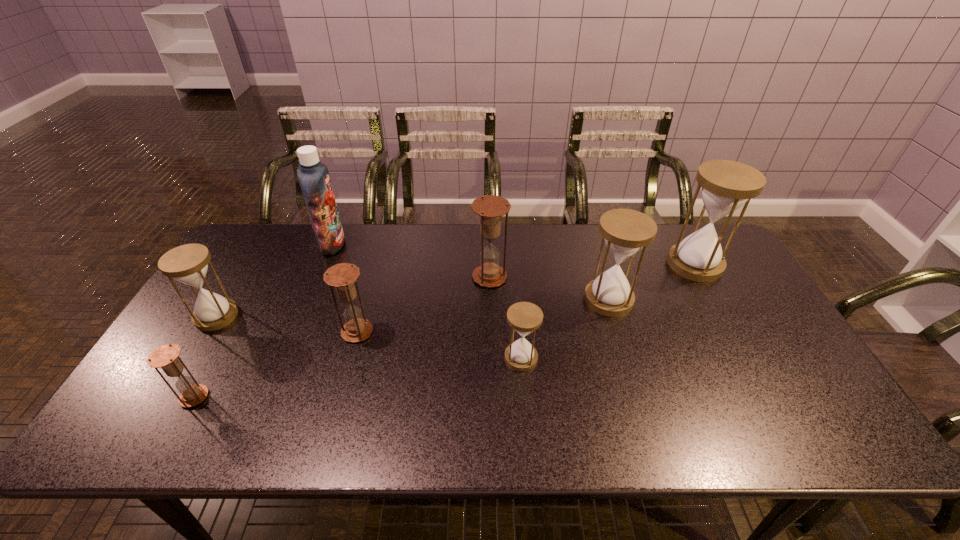
This screenshot has width=960, height=540. Identify the location of vacant space at the far left corner of the desktop. (242, 237).

Where is `vacant space at the near left corner`? The width and height of the screenshot is (960, 540). vacant space at the near left corner is located at coordinates (177, 421).

What are the coordinates of `vacant space at the near right corner of the desktop` in the screenshot? It's located at (804, 431).

Identify the location of vacant area that lies between the nearest white hourglass and the farthest brown hourglass. (505, 318).

Identify the location of vacant area that lies between the sixth hourglass from left to right and the nearest hourglass. Image resolution: width=960 pixels, height=540 pixels. (401, 348).

Where is `free space that is in between the seventh object from left to right and the nearest hourglass`? Image resolution: width=960 pixels, height=540 pixels. free space that is in between the seventh object from left to right and the nearest hourglass is located at coordinates (401, 348).

Where is `free space between the sixth farthest hourglass and the shampoo`? The height and width of the screenshot is (540, 960). free space between the sixth farthest hourglass and the shampoo is located at coordinates (427, 301).

I want to click on free space between the shampoo and the seventh object from left to right, so click(470, 272).

What are the coordinates of `vacant space that is in between the third object from left to right and the third biggest white hourglass` in the screenshot? It's located at (275, 280).

The width and height of the screenshot is (960, 540). Identify the location of empty location between the rightmost object and the smallest brown hourglass. (444, 330).